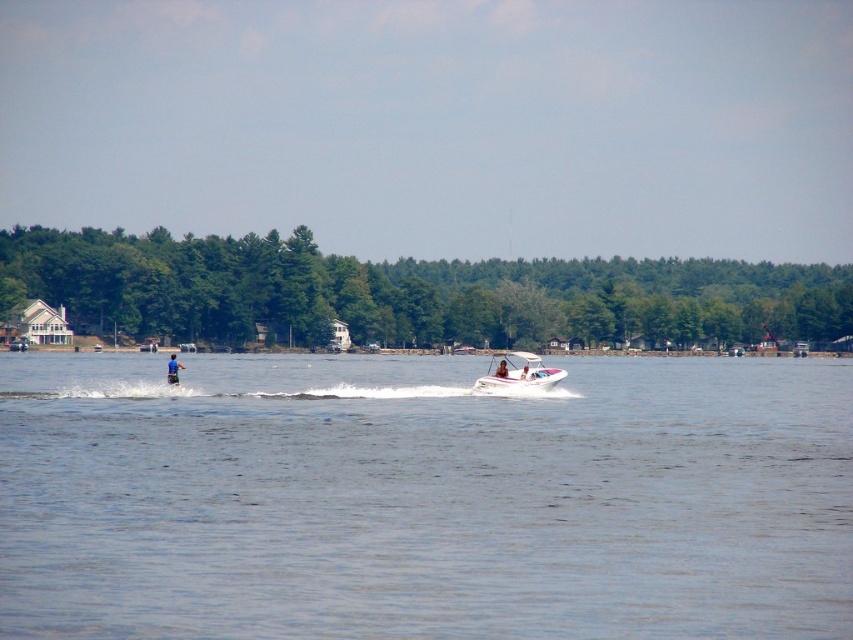
You are standing at the edge of the lake and want to reach the point marked as point (424, 499). According to the scene, where is this point located?

The point (424, 499) is on the clear blue water at center, so you can reach it by moving towards the center of the lake.

You are a photographer trying to capture the blue fabric person at center and the clear blue water at center in a single shot. Based on their positions, which object will appear closer to the camera in the photo?

The clear blue water at center appears closer to the camera because it is positioned in front of the blue fabric person at center in the scene.

You are standing on the lakeside and looking at the scene. There are two points marked in the image, point 1 at coordinates point (416, 624) and point 2 at coordinates point (514, 387). Which point is closer to you?

Point (416, 624) is closer to the viewer than point (514, 387).